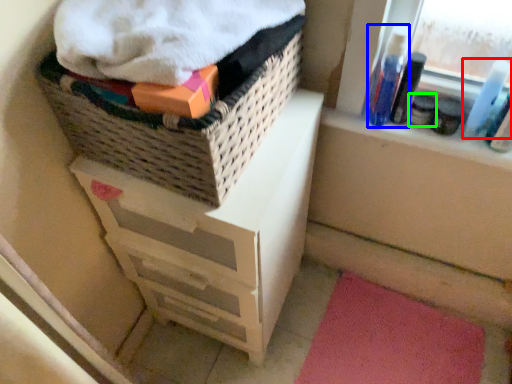
Question: Estimate the real-world distances between objects in this image. Which object is closer to mouthwash (highlighted by a red box), mouthwash (highlighted by a blue box) or toiletry (highlighted by a green box)?

Choices:
 (A) mouthwash
 (B) toiletry

Answer: (B)